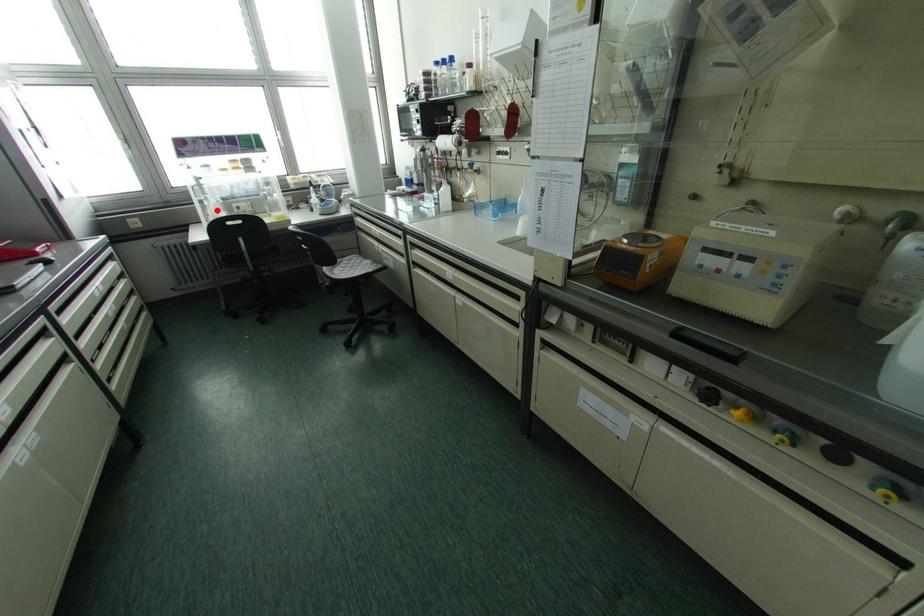
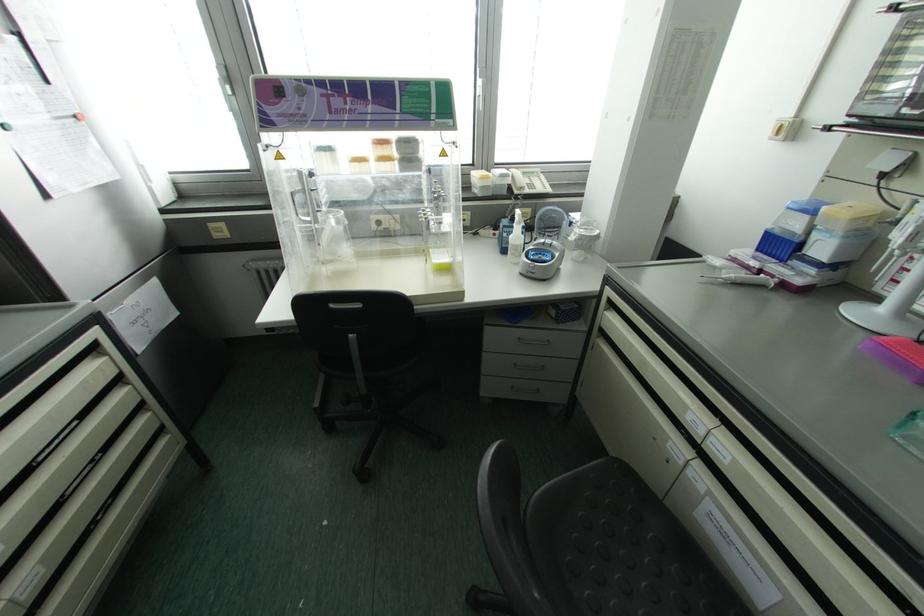
Where in the second image is the point corresponding to the highlighted location from the first image?

(334, 238)